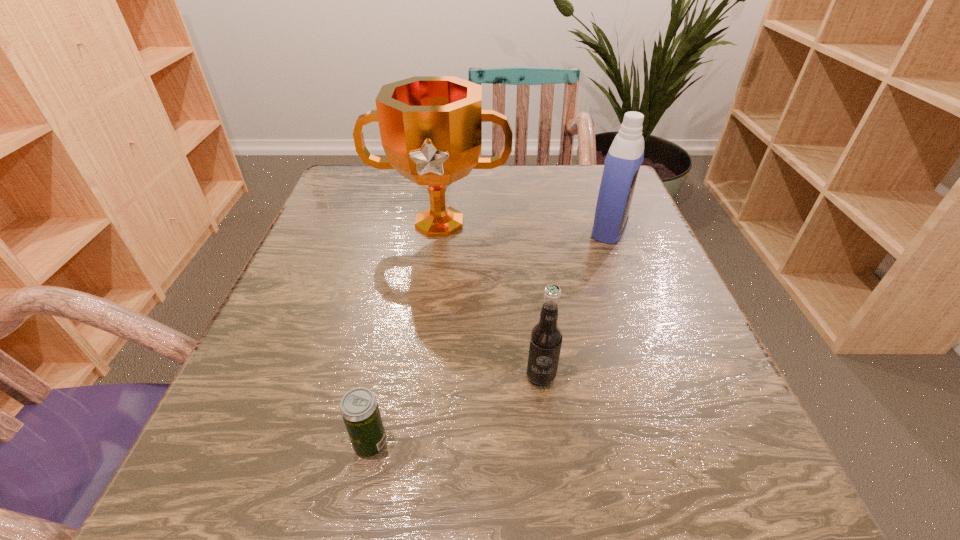
Identify the location of vacant point at the right edge. (654, 287).

Where is `vacant area at the far left corner of the desktop`? The image size is (960, 540). vacant area at the far left corner of the desktop is located at coordinates (321, 214).

In the image, there is a desktop. At what (x,y) coordinates should I click in order to perform the action: click on vacant space at the near left corner. Please return your answer as a coordinate pair (x, y). The width and height of the screenshot is (960, 540). Looking at the image, I should click on (249, 502).

The width and height of the screenshot is (960, 540). I want to click on vacant space at the near right corner of the desktop, so click(x=703, y=491).

What are the coordinates of `vacant area that lies between the award and the detergent` in the screenshot? It's located at (524, 227).

Where is `free space between the nearest object and the award`? free space between the nearest object and the award is located at coordinates (405, 334).

The image size is (960, 540). Find the location of `unoccupied position between the rightmost object and the third tallest object`. unoccupied position between the rightmost object and the third tallest object is located at coordinates (575, 303).

This screenshot has width=960, height=540. I want to click on empty space between the nearest object and the third tallest object, so click(x=455, y=410).

Identify the location of vacant space that's between the second object from right to left and the award. (490, 301).

Identify the location of vacant space in between the award and the beer can. (405, 334).